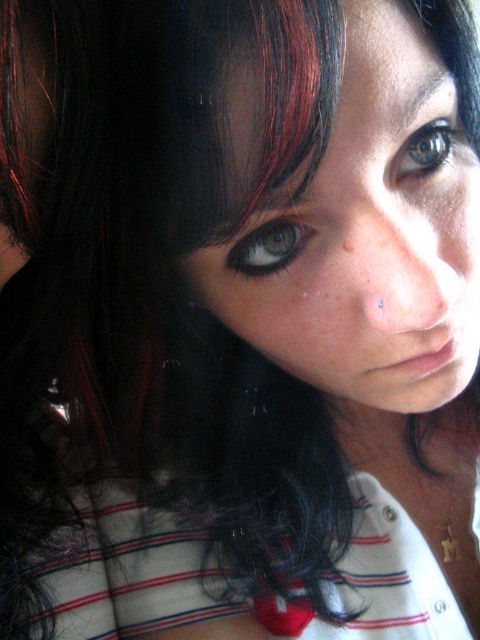
Question: In this image, where is green matte eye at upper center located relative to brown matte freckle at center?

Choices:
 (A) left
 (B) right

Answer: (B)

Question: Can you confirm if green matte eye at upper center is positioned to the right of brown matte freckle at center?

Choices:
 (A) yes
 (B) no

Answer: (A)

Question: Among these objects, which one is nearest to the camera?

Choices:
 (A) matte skin face at center
 (B) brown matte freckle at center
 (C) matte green eye at center

Answer: (A)

Question: Does green matte eye at upper center have a smaller size compared to brown matte freckle at center?

Choices:
 (A) no
 (B) yes

Answer: (A)

Question: Estimate the real-world distances between objects in this image. Which object is farther from the matte skin face at center?

Choices:
 (A) green matte eye at upper center
 (B) brown matte freckle at center

Answer: (B)

Question: Estimate the real-world distances between objects in this image. Which object is closer to the green matte eye at upper center?

Choices:
 (A) brown matte freckle at center
 (B) matte green eye at center
 (C) matte skin face at center

Answer: (A)